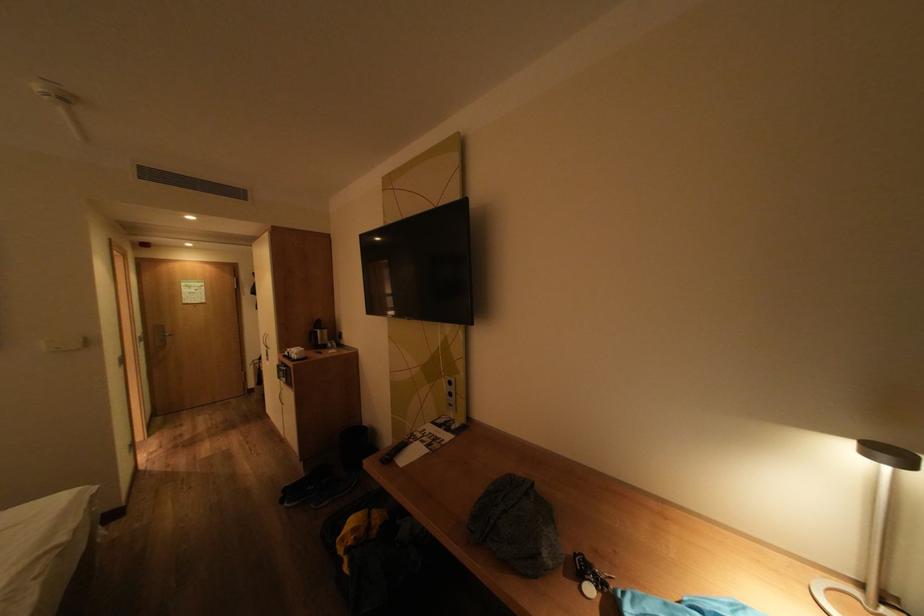
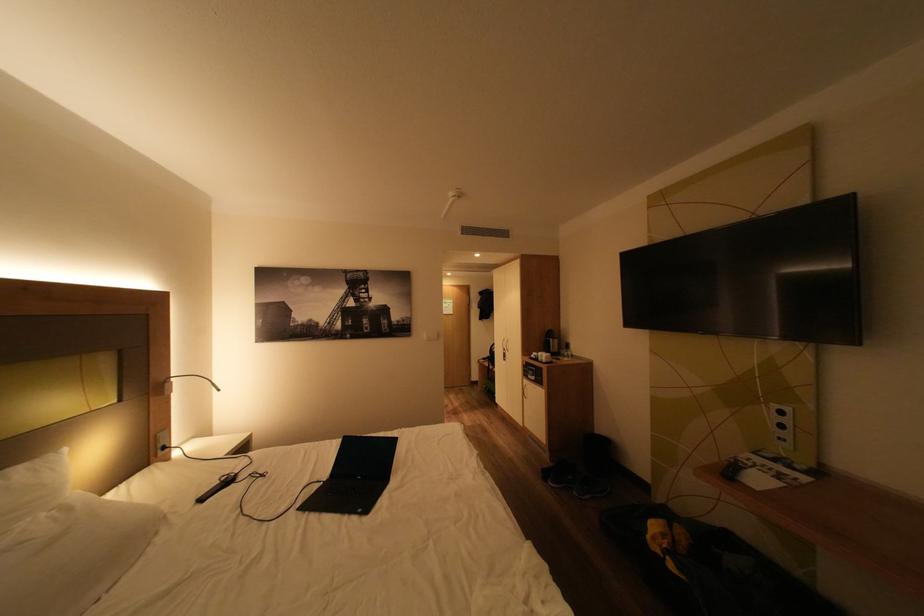
Locate, in the second image, the point that corresponds to point (460, 395) in the first image.

(793, 427)